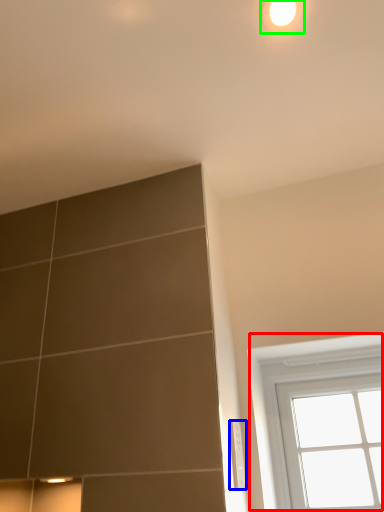
Question: Which is farther away from window (highlighted by a red box)? electric outlet (highlighted by a blue box) or light (highlighted by a green box)?

Choices:
 (A) electric outlet
 (B) light

Answer: (B)